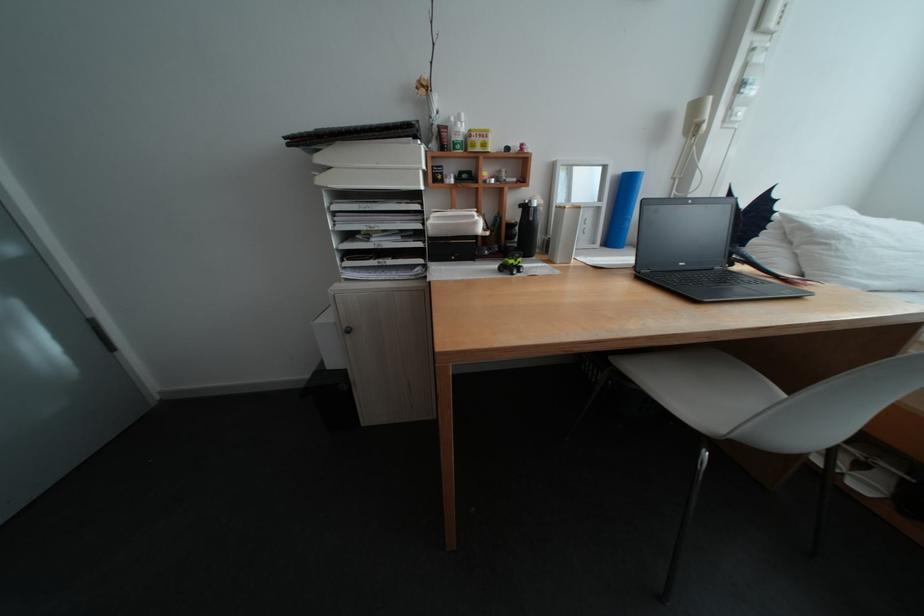
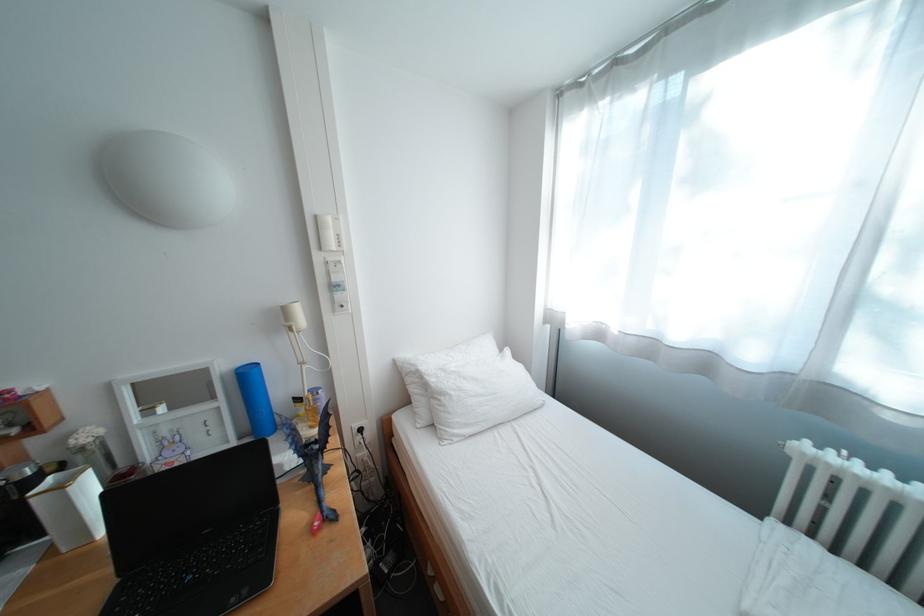
Question: What movement of the cameraman would produce the second image?

Choices:
 (A) Left
 (B) Right
 (C) Forward
 (D) Backward

Answer: (B)